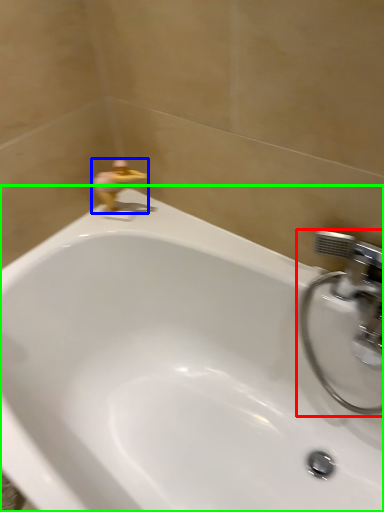
Question: Which object is positioned closest to tap (highlighted by a red box)? Select from plumbing fixture (highlighted by a blue box) and bathtub (highlighted by a green box).

Choices:
 (A) plumbing fixture
 (B) bathtub

Answer: (B)